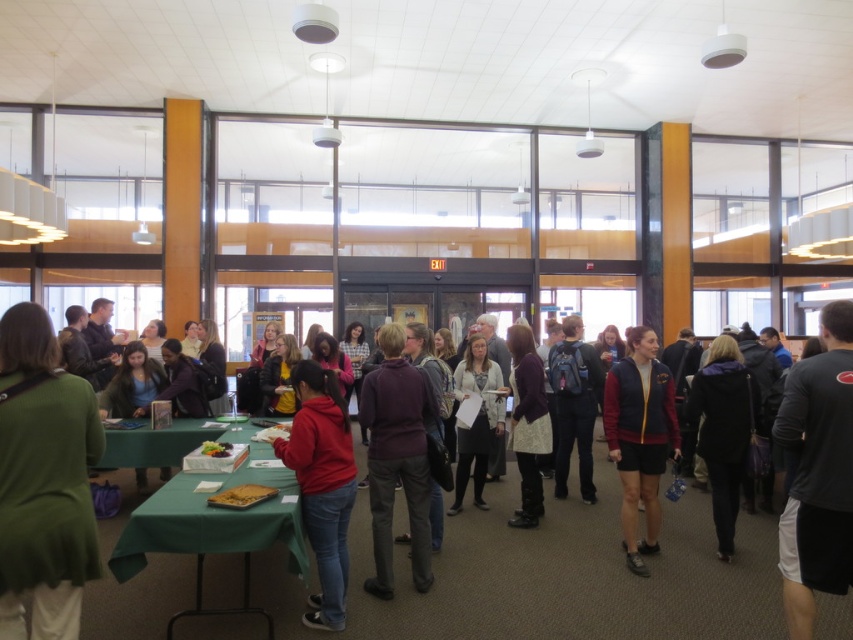
You are at a community event and want to pick up the green sweater at left. Which direction should you move from the green fabric table at lower left to reach it?

The green sweater at left is to the right of the green fabric table at lower left, so you should move to the right from the green fabric table at lower left to reach it.

You are organizing a community event and need to place a new item on the table. You have a green sweater at left and a green fabric table at lower left. Which object is smaller in size?

The green sweater at left is smaller in size compared to the green fabric table at lower left.

You are at a community event and want to grab a hoodie before it gets too crowded. You see the green fabric table at lower left and the matte red hoodie at center. Which item is located more to the left side of the room?

The green fabric table at lower left is positioned on the left side of matte red hoodie at center, so it is more to the left.